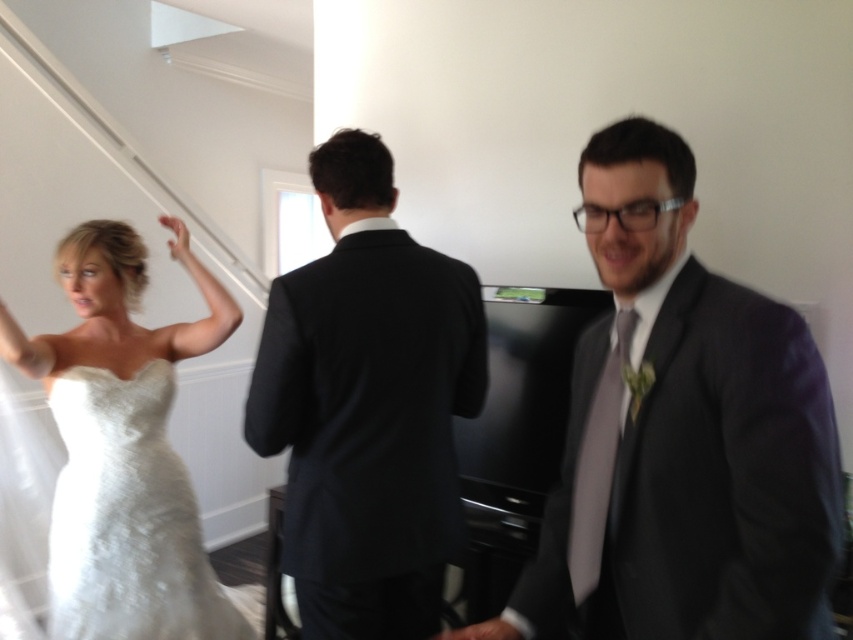
Does point (605, 138) come in front of point (189, 497)?

Yes, point (605, 138) is closer to viewer.

Is matte gray suit at center below satin white dress at left?

Actually, matte gray suit at center is above satin white dress at left.

Measure the distance between matte gray suit at center and camera.

A distance of 36.88 inches exists between matte gray suit at center and camera.

Find the location of a particular element. This screenshot has width=853, height=640. matte gray suit at center is located at coordinates (682, 435).

Looking at this image, between dark suit at center and satin white dress at left, which one is positioned lower?

Positioned lower is satin white dress at left.

Is point (430, 611) closer to viewer compared to point (154, 620)?

Yes, it is.

Locate an element on the screen. dark suit at center is located at coordinates (367, 404).

Who is positioned more to the left, matte gray suit at center or dark suit at center?

dark suit at center

Based on the photo, does matte gray suit at center have a lesser height compared to dark suit at center?

Indeed, matte gray suit at center has a lesser height compared to dark suit at center.

Is point (755, 429) positioned after point (344, 208)?

No, it is in front of (344, 208).

Identify the location of matte gray suit at center. The image size is (853, 640). (682, 435).